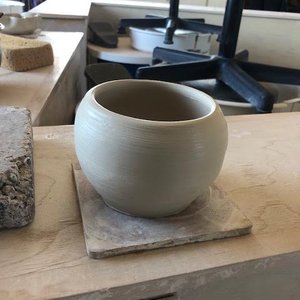
Locate an element on the screen. cupboard is located at coordinates (68, 100).